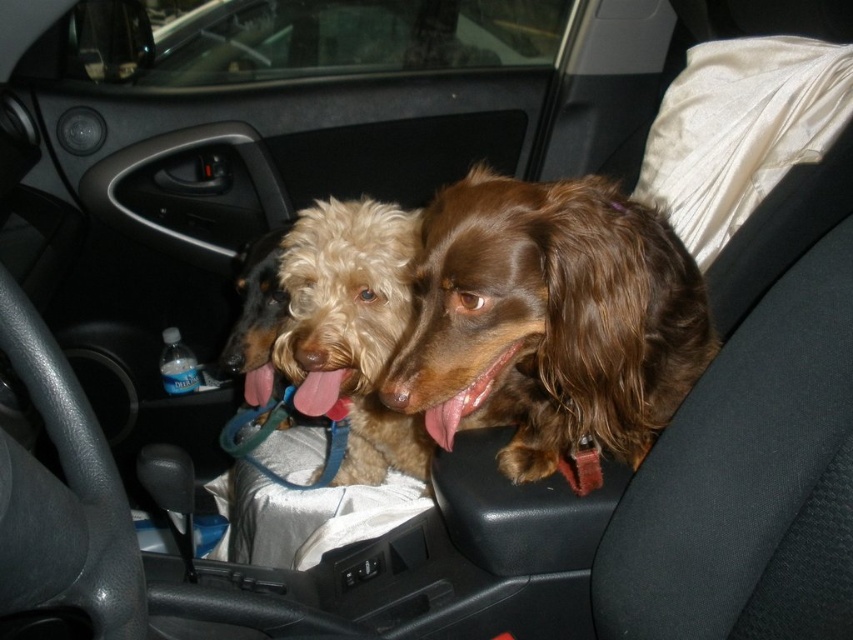
You are a dog trainer assessing the space between two dogs in the car. The car seat has a width of 1 meter. Can both the brown silky dog at center and the fuzzy brown dog at center fit side by side without overlapping?

The brown silky dog at center might be wider than the fuzzy brown dog at center, so it is uncertain if they can fit side by side within the 1 meter width without overlapping. Measure their combined width to confirm.

You are a photographer trying to capture a closeup of the brown silky dog at center. Given that your camera can focus on objects within 30 inches, will you be able to take the photo without moving the dog or the camera?

The brown silky dog at center is 29.06 inches from the camera, which is within the 30 inches focusing range. Therefore, you can take the closeup photo without moving the dog or the camera.